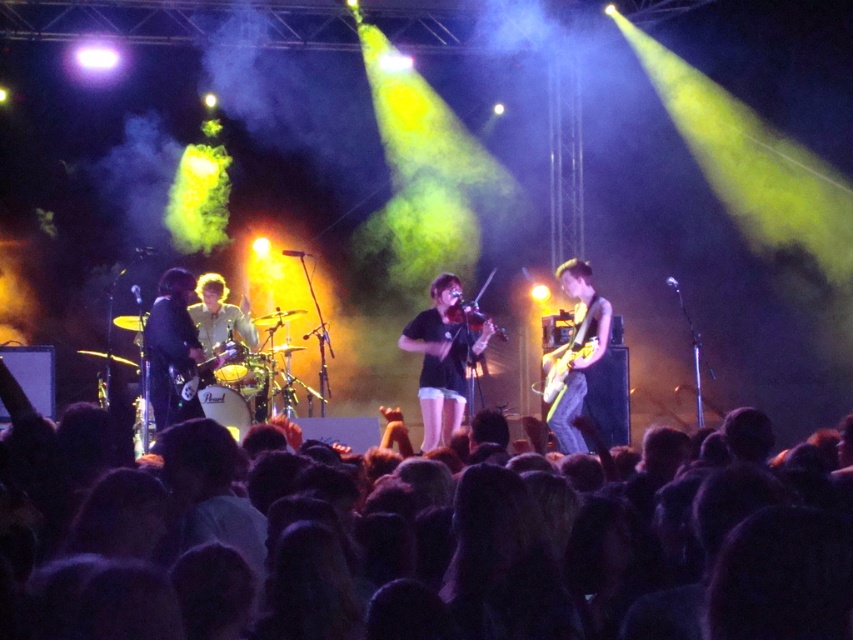
Is black matte violin at center positioned at the back of glossy electric guitar at center?

That is False.

Between point (447, 378) and point (576, 358), which one is positioned in front?

Point (576, 358)

Find the location of a particular element. This screenshot has height=640, width=853. black matte violin at center is located at coordinates pos(442,358).

Describe the element at coordinates (171, 348) in the screenshot. The height and width of the screenshot is (640, 853). I see `shiny black guitar at left` at that location.

The image size is (853, 640). In order to click on shiny black guitar at left in this screenshot , I will do `click(171, 348)`.

Who is more distant from viewer, (193, 404) or (476, 314)?

The point (476, 314) is more distant.

I want to click on shiny black guitar at left, so click(x=171, y=348).

Looking at this image, does shiny black guitar at center appear on the right side of glossy electric guitar at center?

No, shiny black guitar at center is not to the right of glossy electric guitar at center.

Who is more distant from viewer, (581, 262) or (560, 372)?

Positioned behind is point (581, 262).

Is point (543, 369) less distant than point (560, 349)?

No, it is behind (560, 349).

This screenshot has height=640, width=853. Identify the location of shiny black guitar at center. pos(575,355).